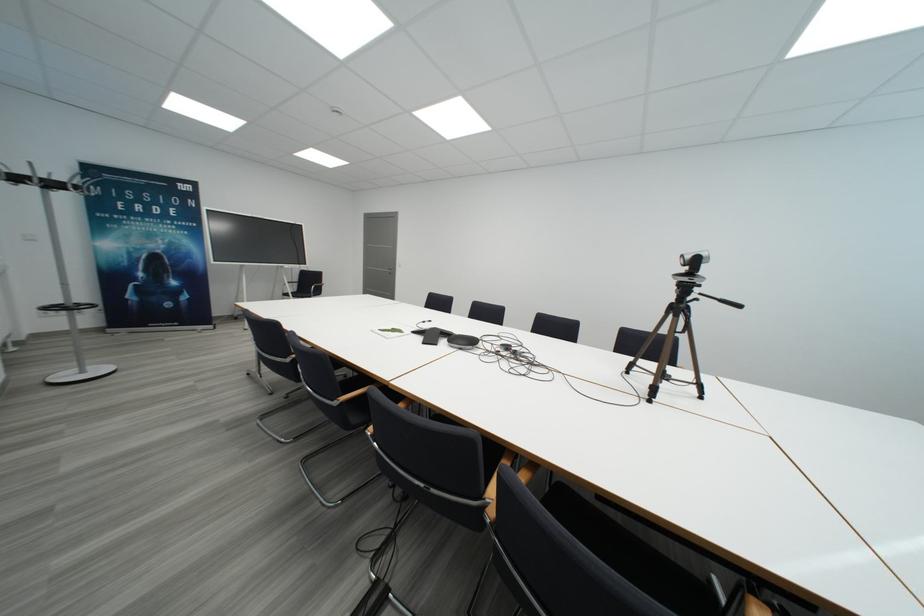
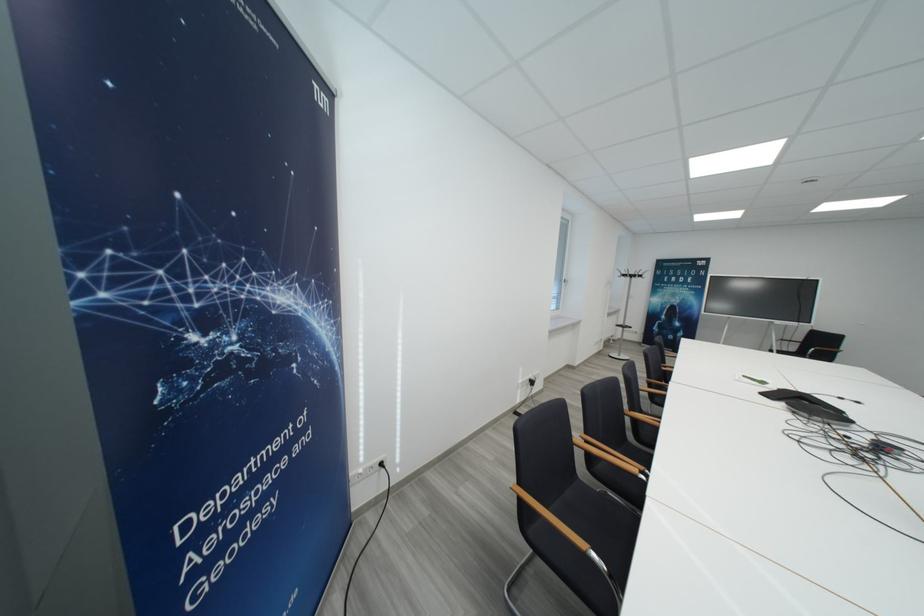
Question: I am providing you with two images of the same scene from different viewpoints. Which of the following objects are not visible in image2?

Choices:
 (A) black chair sitting surface
 (B) black conference phone
 (C) coat rack hook
 (D) black screen handle

Answer: (A)